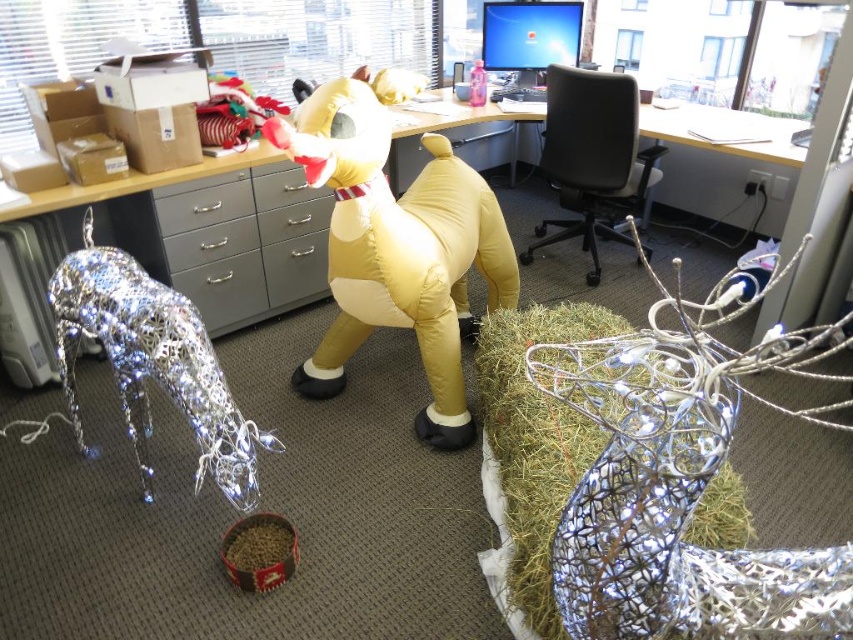
Question: Does yellow inflatable dog at center appear on the left side of matte gray computer desk at center?

Choices:
 (A) no
 (B) yes

Answer: (B)

Question: Is yellow inflatable dog at center further to camera compared to matte gray computer desk at center?

Choices:
 (A) yes
 (B) no

Answer: (B)

Question: Does yellow inflatable dog at center have a lesser width compared to metallic wire reindeer at left?

Choices:
 (A) yes
 (B) no

Answer: (B)

Question: Which object is the closest to the silvery metallic hay at lower right?

Choices:
 (A) metallic wire reindeer at left
 (B) yellow inflatable dog at center

Answer: (B)

Question: Based on their relative distances, which object is farther from the metallic wire reindeer at left?

Choices:
 (A) yellow inflatable dog at center
 (B) matte gray computer desk at center

Answer: (B)

Question: Among these objects, which one is nearest to the camera?

Choices:
 (A) silvery metallic hay at lower right
 (B) matte gray computer desk at center

Answer: (A)